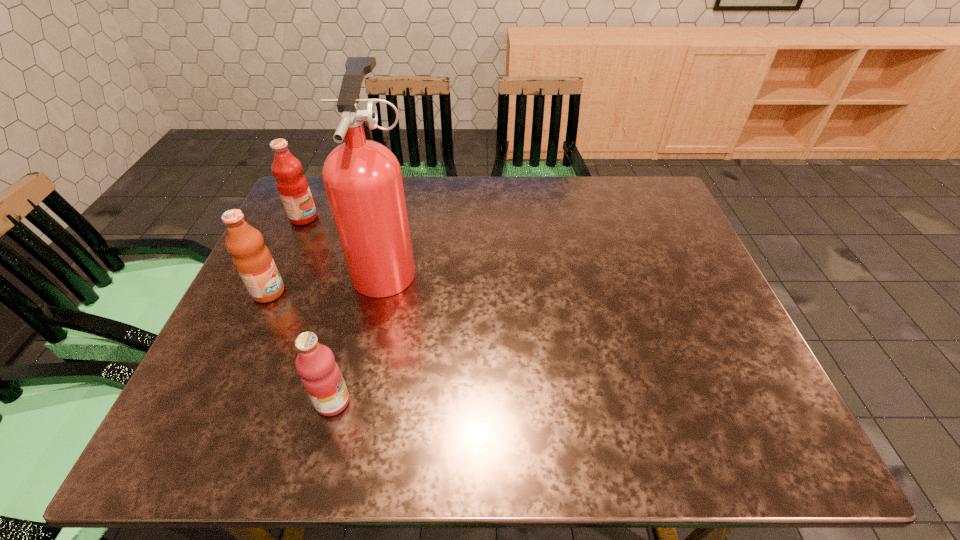
Locate an element on the screen. vacant area in the image that satisfies the following two spatial constraints: 1. on the front side of the tallest object; 2. on the front label of the second farthest fruit juice is located at coordinates (381, 292).

Identify the location of vacant space that satisfies the following two spatial constraints: 1. on the back side of the tallest object; 2. on the front label of the farthest fruit juice. (397, 218).